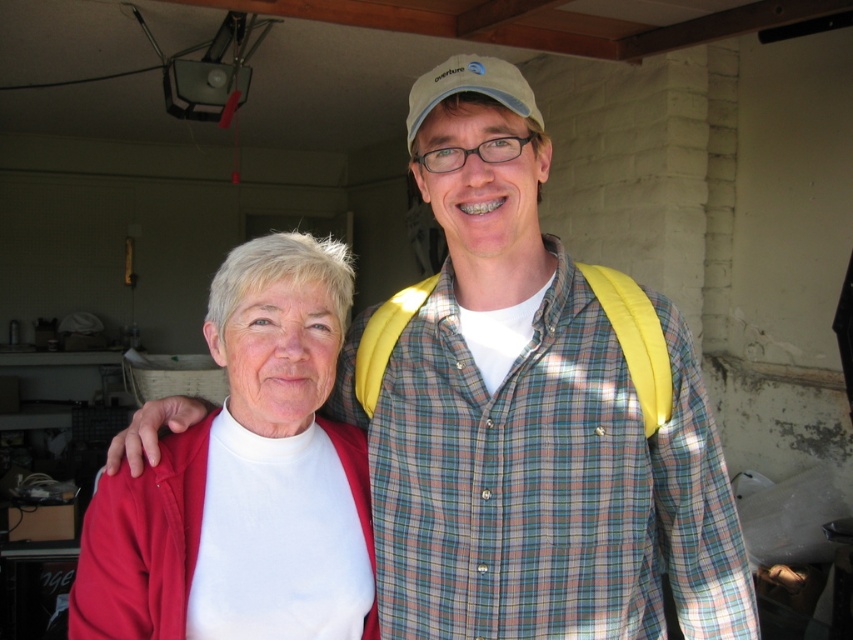
Is yellow fabric backpack at center shorter than matte white turtleneck at center?

No, yellow fabric backpack at center is not shorter than matte white turtleneck at center.

Does point (521, 246) come farther from viewer compared to point (225, 312)?

Yes, point (521, 246) is behind point (225, 312).

Between point (668, 490) and point (251, 454), which one is positioned in front?

Point (251, 454)

You are a GUI agent. You are given a task and a screenshot of the screen. Output one action in this format:
    pyautogui.click(x=<x>, y=<y>)
    Task: Click on the yellow fabric backpack at center
    The image size is (853, 640).
    Given the screenshot: What is the action you would take?
    pyautogui.click(x=531, y=417)